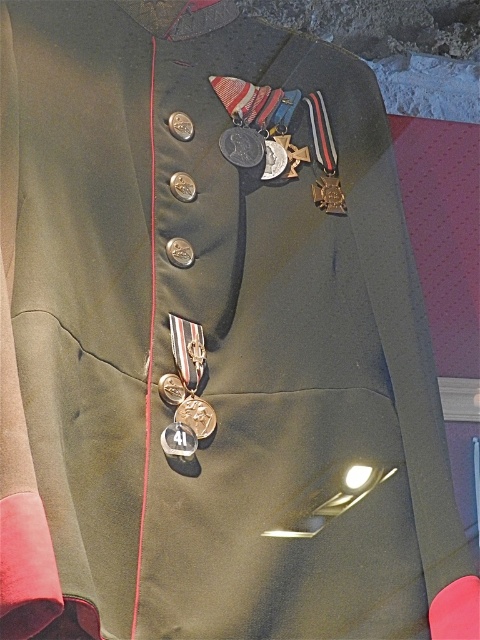
Looking at this image, you are a tailor measuring the placement of a new badge on a military jacket. The existing gold metallic badge at center is located at coordinates 0.650, 0.408. If your new badge must be placed exactly 0.1 units to the right of the existing one, what are the new coordinates?

The new coordinates would be calculated by adding 0.1 to the x coordinate of the existing gold metallic badge at center. The original coordinates are (195, 416), so adding 0.1 to the x gives 0.750. The new coordinates are (195, 480).

You are a tailor measuring the decorations on a military jacket. You need to determine which of the two central decorations, the gold metallic badge at center or the gold metallic cross at center, is wider. Based on the image, which one is wider?

The gold metallic cross at center is wider than the gold metallic badge at center because the gold metallic badge at center has a smaller width as stated in the description.

You are a historian examining the jacket and notice two gold metallic decorations at the center. Which one is positioned lower between the gold metallic badge at center and the gold metallic cross at center?

The gold metallic badge at center is located below the gold metallic cross at center, so it is positioned lower.